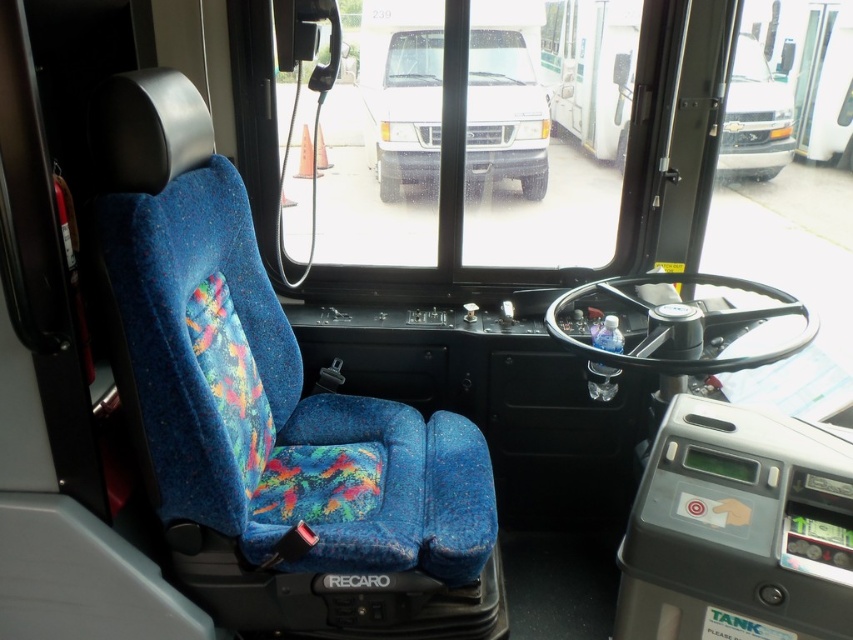
Question: Which point is farther to the camera?

Choices:
 (A) transparent glass window at center
 (B) matte black van at upper center
 (C) matte black van at center

Answer: (C)

Question: Which object appears farthest from the camera in this image?

Choices:
 (A) transparent glass window at center
 (B) matte black van at upper center

Answer: (B)

Question: Does matte black van at center have a smaller size compared to matte black van at upper center?

Choices:
 (A) no
 (B) yes

Answer: (A)

Question: Can you confirm if transparent glass window at center is positioned to the left of matte black van at upper center?

Choices:
 (A) yes
 (B) no

Answer: (A)

Question: Which of the following is the closest to the observer?

Choices:
 (A) transparent glass window at center
 (B) matte black van at upper center
 (C) matte black van at center

Answer: (A)

Question: Is matte black van at center positioned in front of matte black van at upper center?

Choices:
 (A) yes
 (B) no

Answer: (B)